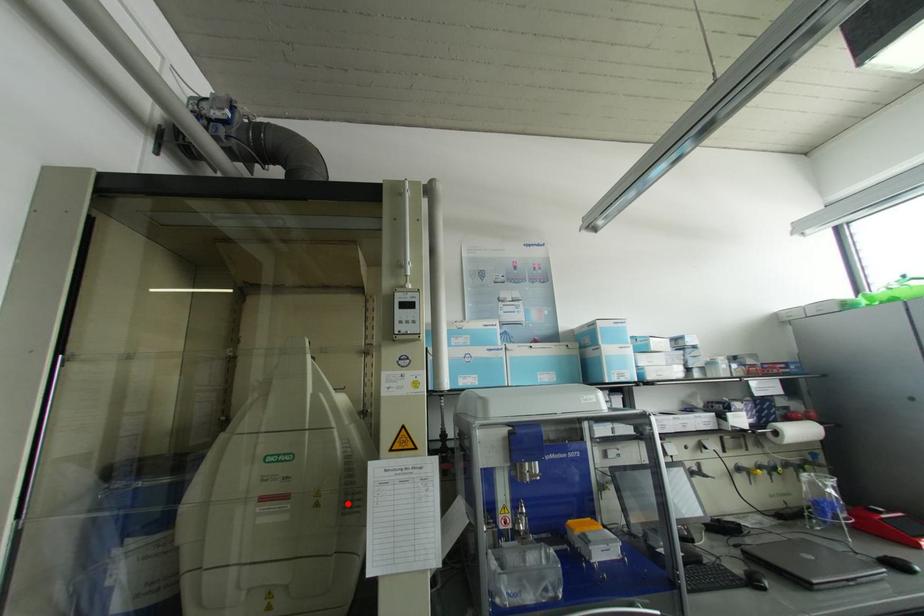
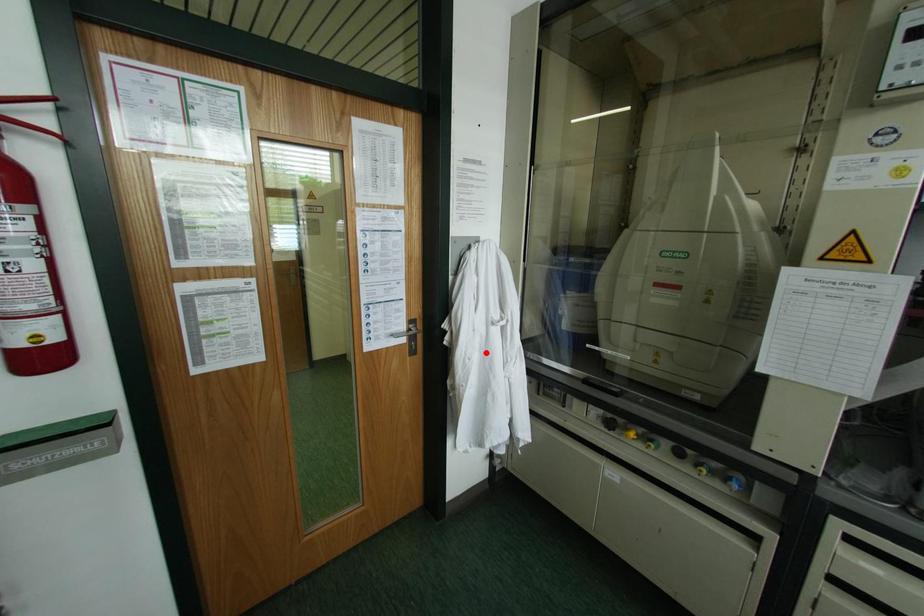
I am providing you with two images of the same scene from different viewpoints. A red point is marked on the first image and another point is marked on the second image. Are the points marked in image1 and image2 representing the same 3D position?

No